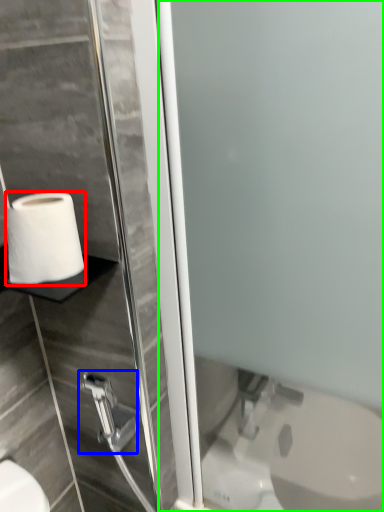
Question: Based on their relative distances, which object is farther from toilet paper (highlighted by a red box)? Choose from shower (highlighted by a blue box) and screen door (highlighted by a green box).

Choices:
 (A) shower
 (B) screen door

Answer: (A)